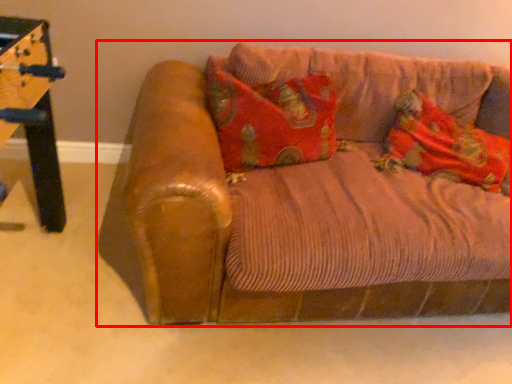
Question: Observing the image, what is the correct spatial positioning of studio couch (annotated by the red box) in reference to material?

Choices:
 (A) left
 (B) right

Answer: (A)